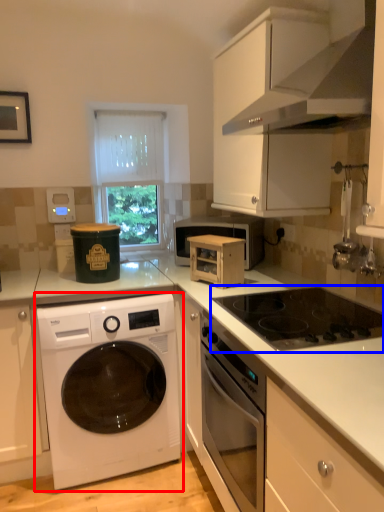
Question: Which object appears farthest to the camera in this image, washing machine (highlighted by a red box) or gas stove (highlighted by a blue box)?

Choices:
 (A) washing machine
 (B) gas stove

Answer: (A)